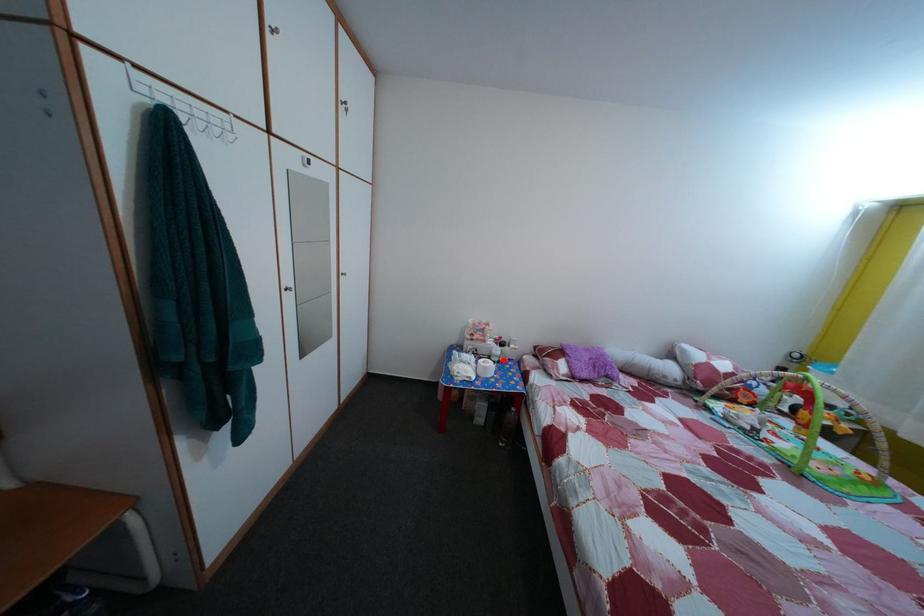
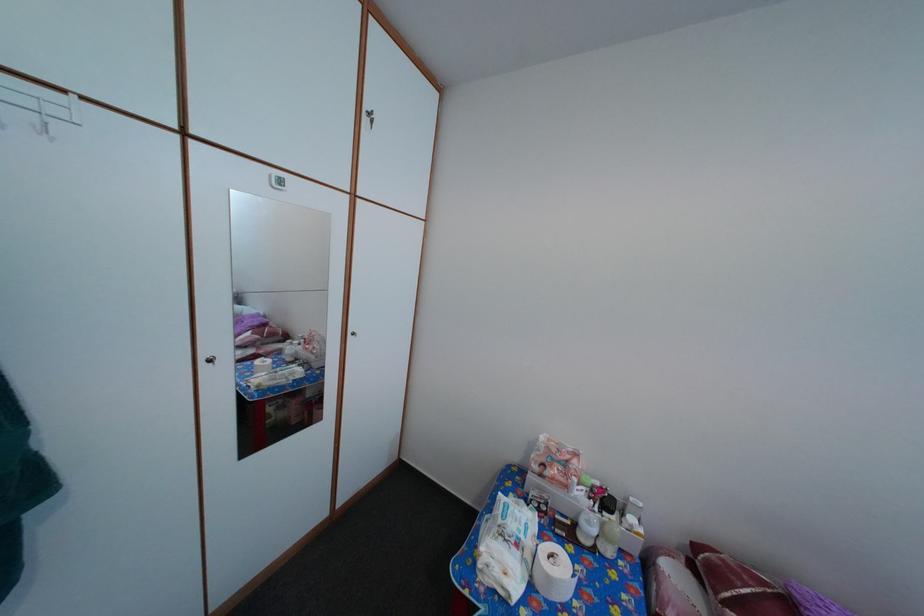
In the second image, find the point that corresponds to the highlighted location in the first image.

(592, 531)